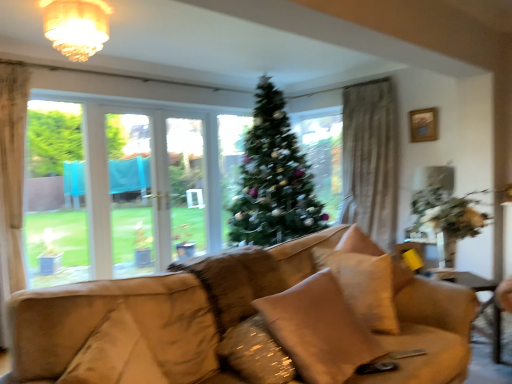
This screenshot has width=512, height=384. What do you see at coordinates (76, 26) in the screenshot?
I see `matte glass chandelier at upper center` at bounding box center [76, 26].

How much space does beige fabric pillow at center, the second pillow when ordered from front to back, occupy vertically?

It is 20.16 centimeters.

Identify the location of wooden picture frame at upper right. (423, 125).

This screenshot has width=512, height=384. What do you see at coordinates (318, 330) in the screenshot? I see `beige fabric pillow at center, which appears as the 1th pillow when viewed from the front` at bounding box center [318, 330].

The image size is (512, 384). Identify the location of matte glass chandelier at upper center. point(76,26).

Locate an element on the screen. Image resolution: width=512 pixels, height=384 pixels. christmas tree above the beige fabric pillow at center, the 1th pillow in the back-to-front sequence (from a real-world perspective) is located at coordinates point(273,179).

In terms of height, does beige fabric pillow at center, the 1th pillow in the back-to-front sequence, look taller or shorter compared to green matte christmas tree at center?

Clearly, beige fabric pillow at center, the 1th pillow in the back-to-front sequence, is shorter compared to green matte christmas tree at center.

From the image's perspective, which object appears higher, beige fabric pillow at center, the 1th pillow in the back-to-front sequence, or green matte christmas tree at center?

green matte christmas tree at center.

Can you tell me how much beige fabric pillow at center, the 1th pillow in the back-to-front sequence, and green matte christmas tree at center differ in facing direction?

There is a 54-degree angle between the facing directions of beige fabric pillow at center, the 1th pillow in the back-to-front sequence, and green matte christmas tree at center.

From a real-world perspective, is wooden picture frame at upper right above or below matte glass chandelier at upper center?

wooden picture frame at upper right is below matte glass chandelier at upper center.

Is wooden picture frame at upper right oriented towards matte glass chandelier at upper center?

Yes, wooden picture frame at upper right faces towards matte glass chandelier at upper center.

Would you say wooden picture frame at upper right contains matte glass chandelier at upper center?

That's incorrect, matte glass chandelier at upper center is not inside wooden picture frame at upper right.

Is wooden picture frame at upper right not close to matte glass chandelier at upper center?

Indeed, wooden picture frame at upper right is not near matte glass chandelier at upper center.

Is wooden picture frame at upper right positioned before beige fabric pillow at center, the third pillow positioned from the back?

No.

In the image, is wooden picture frame at upper right on the left side or the right side of beige fabric pillow at center, the third pillow positioned from the back?

wooden picture frame at upper right is to the right of beige fabric pillow at center, the third pillow positioned from the back.

Considering the sizes of wooden picture frame at upper right and beige fabric pillow at center, the third pillow positioned from the back, in the image, is wooden picture frame at upper right wider or thinner than beige fabric pillow at center, the third pillow positioned from the back,?

Considering their sizes, wooden picture frame at upper right looks slimmer than beige fabric pillow at center, the third pillow positioned from the back.

Are wooden picture frame at upper right and beige fabric pillow at center, the third pillow positioned from the back, making contact?

wooden picture frame at upper right and beige fabric pillow at center, the third pillow positioned from the back, are not in contact.

Is suede tan swivel chair at lower left next to beige fabric pillow at center, placed as the third pillow when sorted from front to back, and touching it?

suede tan swivel chair at lower left and beige fabric pillow at center, placed as the third pillow when sorted from front to back, are not in contact.

Looking at the image, does suede tan swivel chair at lower left seem bigger or smaller compared to beige fabric pillow at center, the 1th pillow in the back-to-front sequence?

suede tan swivel chair at lower left is bigger than beige fabric pillow at center, the 1th pillow in the back-to-front sequence.

Who is more distant, suede tan swivel chair at lower left or beige fabric pillow at center, the 1th pillow in the back-to-front sequence?

beige fabric pillow at center, the 1th pillow in the back-to-front sequence, is further away from the camera.

Is suede tan swivel chair at lower left wider or thinner than beige fabric pillow at center, the 2th pillow viewed from the back?

suede tan swivel chair at lower left is thinner than beige fabric pillow at center, the 2th pillow viewed from the back.

From a real-world perspective, between suede tan swivel chair at lower left and beige fabric pillow at center, the 2th pillow viewed from the back, who is vertically lower?

beige fabric pillow at center, the 2th pillow viewed from the back.

From the image's perspective, which is below, suede tan swivel chair at lower left or beige fabric pillow at center, the 2th pillow viewed from the back?

beige fabric pillow at center, the 2th pillow viewed from the back, from the image's perspective.

Where is `swivel chair on the left of beige fabric pillow at center, the 2th pillow viewed from the back`? This screenshot has width=512, height=384. swivel chair on the left of beige fabric pillow at center, the 2th pillow viewed from the back is located at coordinates (104, 317).

Which of these two, beige fabric pillow at center, which appears as the 1th pillow when viewed from the front, or suede tan swivel chair at lower left, stands taller?

beige fabric pillow at center, which appears as the 1th pillow when viewed from the front.

Between point (302, 337) and point (160, 316), which one is positioned behind?

The point (302, 337) is farther from the camera.

In the scene shown: Between beige fabric pillow at center, the third pillow positioned from the back, and suede tan swivel chair at lower left, which one has larger size?

Bigger between the two is beige fabric pillow at center, the third pillow positioned from the back.

Could you measure the distance between beige fabric pillow at center, the third pillow positioned from the back, and suede tan swivel chair at lower left?

beige fabric pillow at center, the third pillow positioned from the back, is 19.72 inches away from suede tan swivel chair at lower left.

Is green matte christmas tree at center to the left or to the right of beige fabric pillow at center, the 1th pillow in the back-to-front sequence, in the image?

green matte christmas tree at center is to the left of beige fabric pillow at center, the 1th pillow in the back-to-front sequence.

From a real-world perspective, is green matte christmas tree at center above or below beige fabric pillow at center, placed as the third pillow when sorted from front to back?

green matte christmas tree at center is situated higher than beige fabric pillow at center, placed as the third pillow when sorted from front to back, in the real world.

Locate an element on the screen. The image size is (512, 384). christmas tree lying behind the beige fabric pillow at center, placed as the third pillow when sorted from front to back is located at coordinates (273, 179).

Considering the relative positions of green matte christmas tree at center and beige fabric pillow at center, the 1th pillow in the back-to-front sequence, in the image provided, is green matte christmas tree at center behind beige fabric pillow at center, the 1th pillow in the back-to-front sequence,?

Yes, green matte christmas tree at center is further from the viewer.

The width and height of the screenshot is (512, 384). What are the coordinates of `pillow that is the 2nd object to the right of the green matte christmas tree at center, starting at the anchor` in the screenshot? It's located at (364, 286).

Find the location of a particular element. This screenshot has height=384, width=512. light fixture that appears in front of the wooden picture frame at upper right is located at coordinates (76, 26).

Estimate the real-world distances between objects in this image. Which object is further from beige fabric pillow at center, the second pillow when ordered from front to back, matte glass chandelier at upper center or wooden picture frame at upper right?

wooden picture frame at upper right.

When comparing their distances from green matte christmas tree at center, does suede tan swivel chair at lower left or beige fabric pillow at center, the 1th pillow in the back-to-front sequence, seem closer?

The object closer to green matte christmas tree at center is beige fabric pillow at center, the 1th pillow in the back-to-front sequence.

Which object lies nearer to the anchor point beige fabric pillow at center, the 2th pillow viewed from the back, matte glass chandelier at upper center or green matte christmas tree at center?

Among the two, matte glass chandelier at upper center is located nearer to beige fabric pillow at center, the 2th pillow viewed from the back.

Considering their positions, is beige fabric pillow at center, placed as the third pillow when sorted from front to back, positioned closer to suede tan swivel chair at lower left than beige fabric pillow at center, which appears as the 1th pillow when viewed from the front?

beige fabric pillow at center, which appears as the 1th pillow when viewed from the front, is positioned closer to the anchor suede tan swivel chair at lower left.

When comparing their distances from beige fabric pillow at center, the second pillow when ordered from front to back, does wooden picture frame at upper right or suede tan swivel chair at lower left seem further?

Based on the image, wooden picture frame at upper right appears to be further to beige fabric pillow at center, the second pillow when ordered from front to back.

Estimate the real-world distances between objects in this image. Which object is further from beige fabric pillow at center, the third pillow positioned from the back, green matte christmas tree at center or suede tan swivel chair at lower left?

green matte christmas tree at center is positioned further to the anchor beige fabric pillow at center, the third pillow positioned from the back.

Estimate the real-world distances between objects in this image. Which object is closer to suede tan swivel chair at lower left, beige fabric pillow at center, the second pillow when ordered from front to back, or wooden picture frame at upper right?

Based on the image, beige fabric pillow at center, the second pillow when ordered from front to back, appears to be nearer to suede tan swivel chair at lower left.

From the image, which object appears to be farther from suede tan swivel chair at lower left, green matte christmas tree at center or beige fabric pillow at center, the 1th pillow in the back-to-front sequence?

green matte christmas tree at center.

Identify the location of swivel chair between matte glass chandelier at upper center and beige fabric pillow at center, the 2th pillow viewed from the back, from top to bottom. (104, 317).

Locate an element on the screen. This screenshot has width=512, height=384. light fixture between beige fabric pillow at center, the 2th pillow viewed from the back, and green matte christmas tree at center from front to back is located at coordinates (76, 26).

Where is `christmas tree positioned between beige fabric pillow at center, which appears as the 1th pillow when viewed from the front, and wooden picture frame at upper right from near to far`? christmas tree positioned between beige fabric pillow at center, which appears as the 1th pillow when viewed from the front, and wooden picture frame at upper right from near to far is located at coordinates (273, 179).

I want to click on christmas tree between matte glass chandelier at upper center and beige fabric pillow at center, placed as the third pillow when sorted from front to back, in the horizontal direction, so click(273, 179).